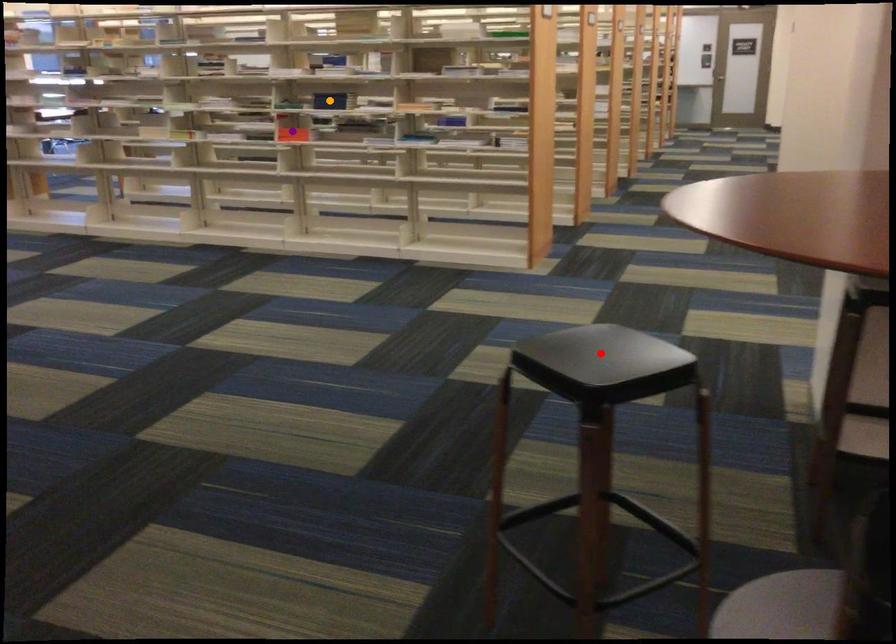
Order these from nearest to farthest:
A) orange point
B) purple point
C) red point

red point, orange point, purple point